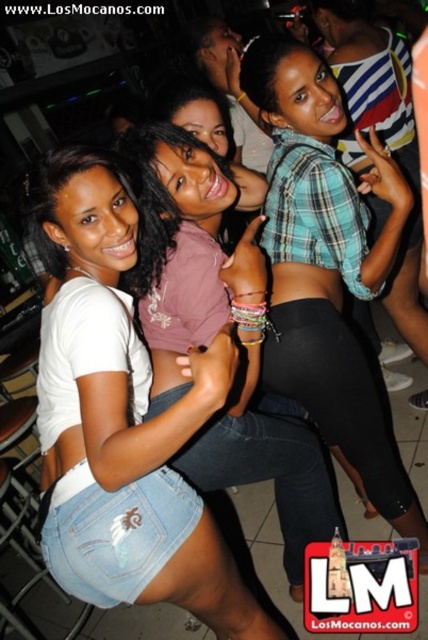
Is denim shorts at center to the left of plaid fabric shirt at center from the viewer's perspective?

Indeed, denim shorts at center is positioned on the left side of plaid fabric shirt at center.

Is denim shorts at center smaller than plaid fabric shirt at center?

Actually, denim shorts at center might be larger than plaid fabric shirt at center.

Which is behind, point (171, 598) or point (318, 344)?

Point (318, 344)

Locate an element on the screen. This screenshot has width=428, height=640. denim shorts at center is located at coordinates (127, 420).

Does denim shorts at center have a larger size compared to plaid fabric crop top at center?

No.

Locate an element on the screen. The image size is (428, 640). denim shorts at center is located at coordinates (127, 420).

You are a GUI agent. You are given a task and a screenshot of the screen. Output one action in this format:
    pyautogui.click(x=<x>, y=<y>)
    Task: Click on the denim shorts at center
    This screenshot has width=428, height=640.
    Given the screenshot: What is the action you would take?
    pyautogui.click(x=127, y=420)

Where is `denim shorts at center`? This screenshot has height=640, width=428. denim shorts at center is located at coordinates (127, 420).

Who is shorter, plaid fabric shirt at center or plaid fabric crop top at center?

With less height is plaid fabric shirt at center.

The width and height of the screenshot is (428, 640). What do you see at coordinates (329, 268) in the screenshot?
I see `plaid fabric shirt at center` at bounding box center [329, 268].

Identify the location of plaid fabric shirt at center. (329, 268).